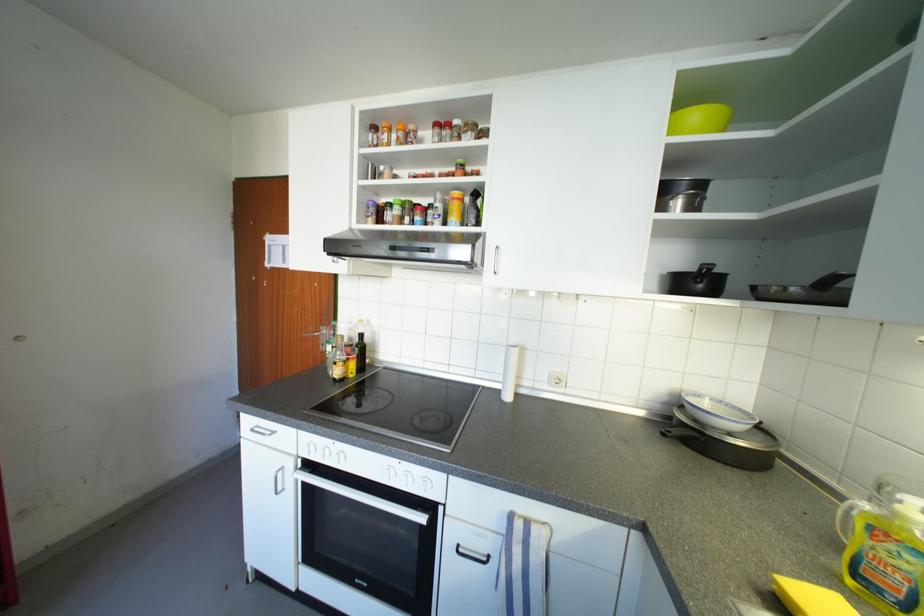
The width and height of the screenshot is (924, 616). Identify the location of yellow plastic bowl. (699, 120).